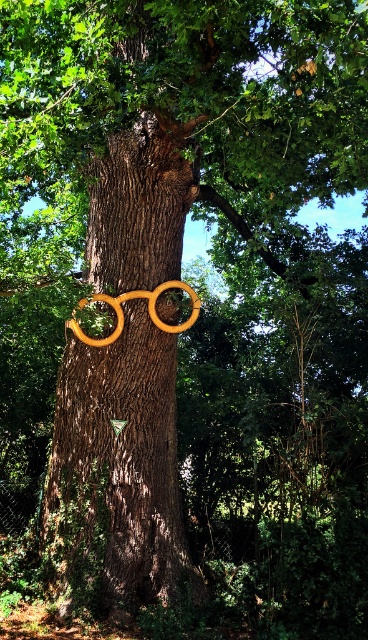
You are a gardener who wants to place a wooden hula hoop around the brown rough tree trunk at center. The hula hoop needs to be exactly touching the tree trunk to secure it properly. Based on the image, is the wooden hula hoop at center positioned correctly?

The brown rough tree trunk at center and wooden hula hoop at center are 20.48 inches apart, so the wooden hula hoop at center is too far away to be touching the tree trunk. It needs to be moved closer to ensure proper placement.

You are standing in front of the brown rough tree trunk at center and want to take a photo with your camera. If the camera requires a minimum distance of 4 meters to focus properly, will you be able to take a clear photo?

The brown rough tree trunk at center and camera are 5.00 meters apart, which is more than the required 4 meters. Therefore, you can take a clear photo.